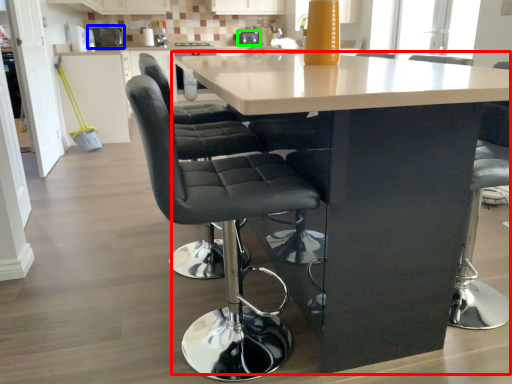
Question: Which object is the closest to the table (highlighted by a red box)? Choose among these: appliance (highlighted by a blue box) or appliance (highlighted by a green box).

Choices:
 (A) appliance
 (B) appliance

Answer: (B)